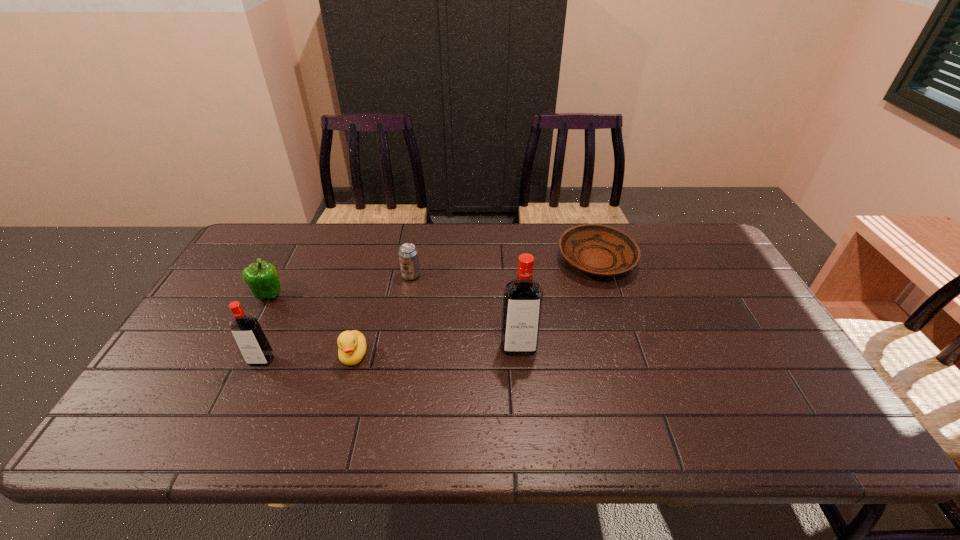
Observe the arrangement of all vodkas in the image. To keep them evenly spaced, where would you place another vodka on the right? Please locate a free space. Please provide its 2D coordinates. Your answer should be formatted as a tuple, i.e. [(x, y)], where the tuple contains the x and y coordinates of a point satisfying the conditions above.

[(762, 335)]